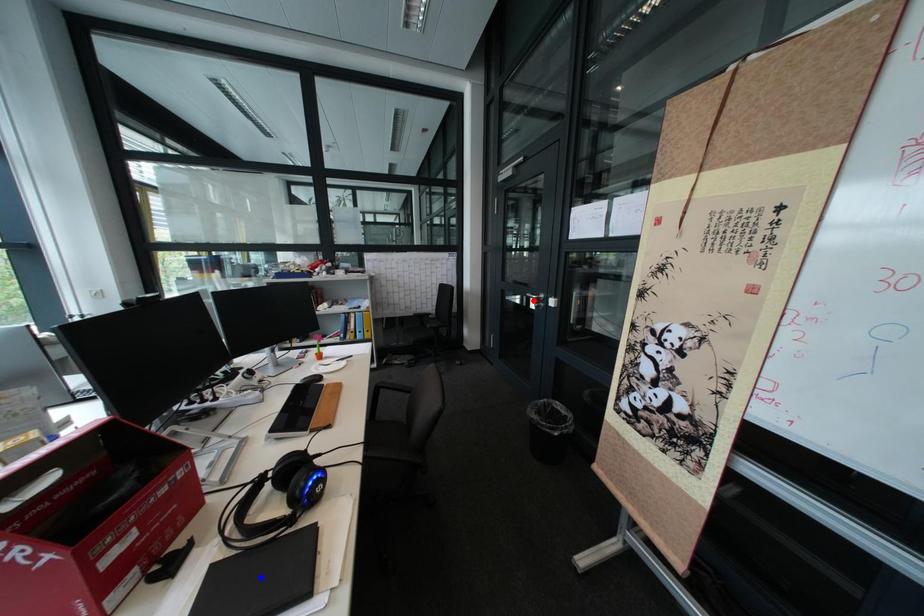
Question: Which of the two points in the image is closer to the camera?

Choices:
 (A) Blue point is closer.
 (B) Red point is closer.

Answer: (A)